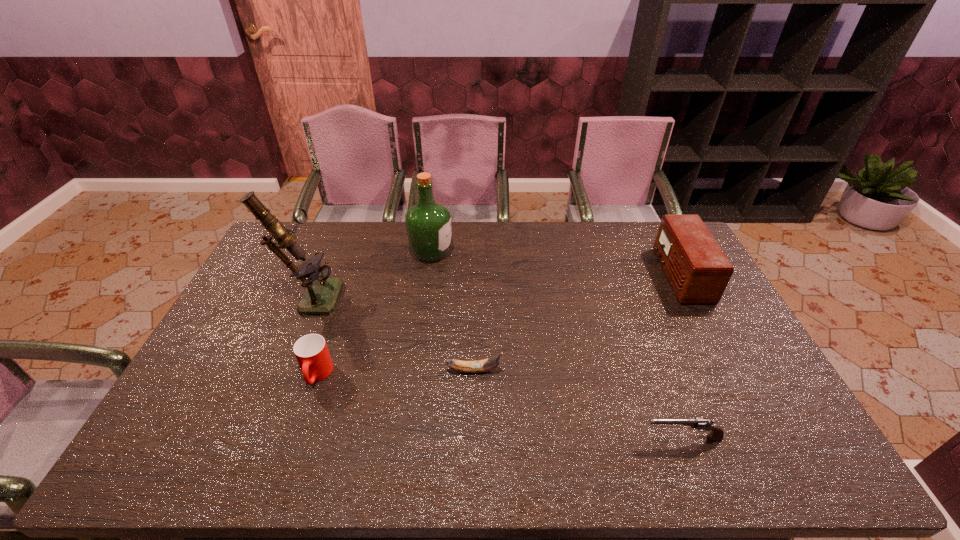
Where is `vacant space located on the front-facing side of the liquor`? The width and height of the screenshot is (960, 540). vacant space located on the front-facing side of the liquor is located at coordinates (558, 253).

At what (x,y) coordinates should I click in order to perform the action: click on free spot located 0.360m on the front-facing side of the fourth shortest object. Please return your answer as a coordinate pair (x, y). This screenshot has height=540, width=960. Looking at the image, I should click on (558, 275).

Locate an element on the screen. This screenshot has height=540, width=960. vacant area situated on the front-facing side of the fourth shortest object is located at coordinates (604, 275).

What are the coordinates of `free space located 0.250m on the front-facing side of the fourth shortest object` in the screenshot? It's located at (589, 275).

Where is `vacant area situated 0.140m on the side of the fourth tallest object with the handle`? This screenshot has height=540, width=960. vacant area situated 0.140m on the side of the fourth tallest object with the handle is located at coordinates (295, 441).

Identify the location of vacant position located 0.070m at the stem of the banana. The height and width of the screenshot is (540, 960). (527, 370).

Identify the location of vacant space located 0.100m aiming along the barrel of the second object from right to left. This screenshot has height=540, width=960. (602, 438).

At what (x,y) coordinates should I click in order to perform the action: click on vacant space located 0.180m aiming along the barrel of the second object from right to left. Please return your answer as a coordinate pair (x, y). The height and width of the screenshot is (540, 960). Looking at the image, I should click on (570, 438).

You are a GUI agent. You are given a task and a screenshot of the screen. Output one action in this format:
    pyautogui.click(x=<x>, y=<y>)
    Task: Click on the vacant region located 0.360m aiming along the barrel of the second object from right to left
    
    Given the screenshot: What is the action you would take?
    pyautogui.click(x=496, y=438)

Locate an element on the screen. liquor situated at the far edge is located at coordinates (428, 223).